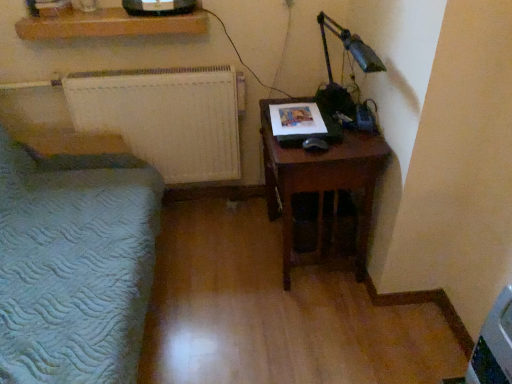
Question: Considering the positions of point (273, 175) and point (89, 29), is point (273, 175) closer or farther from the camera than point (89, 29)?

Choices:
 (A) farther
 (B) closer

Answer: (B)

Question: From the image's perspective, relative to wooden shelf at upper center, is brown wooden nightstand at right above or below?

Choices:
 (A) below
 (B) above

Answer: (A)

Question: Which of these objects is positioned farthest from the white textured radiator at left?

Choices:
 (A) white textured radiator at left
 (B) brown wooden nightstand at right
 (C) metallic green desk lamp at upper right
 (D) wooden shelf at upper center

Answer: (C)

Question: Which of these objects is positioned closest to the brown wooden nightstand at right?

Choices:
 (A) metallic green desk lamp at upper right
 (B) white textured radiator at left
 (C) wooden shelf at upper center
 (D) white textured radiator at left

Answer: (A)